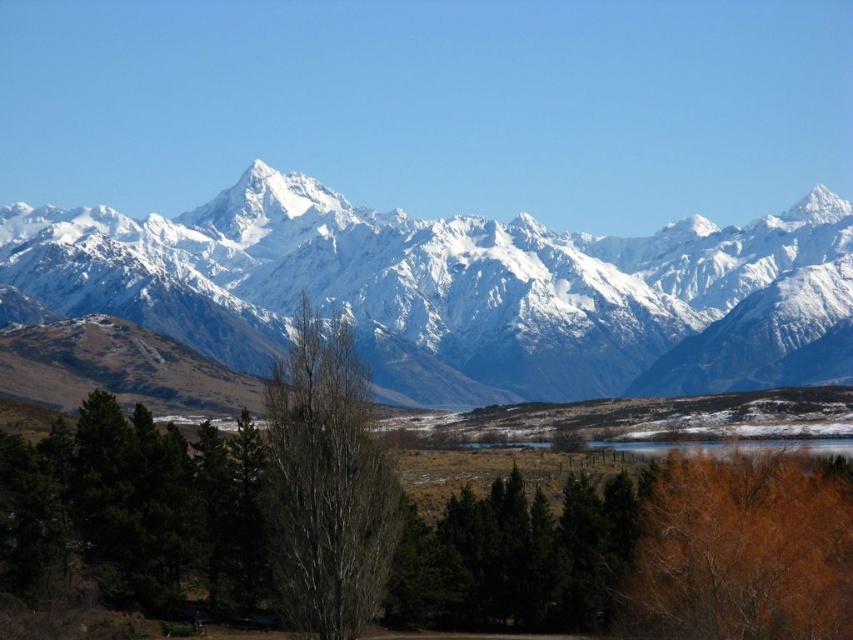
You are planning to set up a tent for a camping trip. You have two options for locations near the brown leafy tree at lower right and the bare bark tree at center. Considering their sizes, which tree would provide more shade coverage for your tent?

The brown leafy tree at lower right has a larger size compared to the bare bark tree at center, so it would provide more shade coverage for your tent.

You are standing in the landscape scene looking at the snowcapped mountains. There is a point marked at coordinates [743,548]. What object in the scene corresponds to this point?

The point at coordinates [743,548] corresponds to the brown leafy tree at lower right.